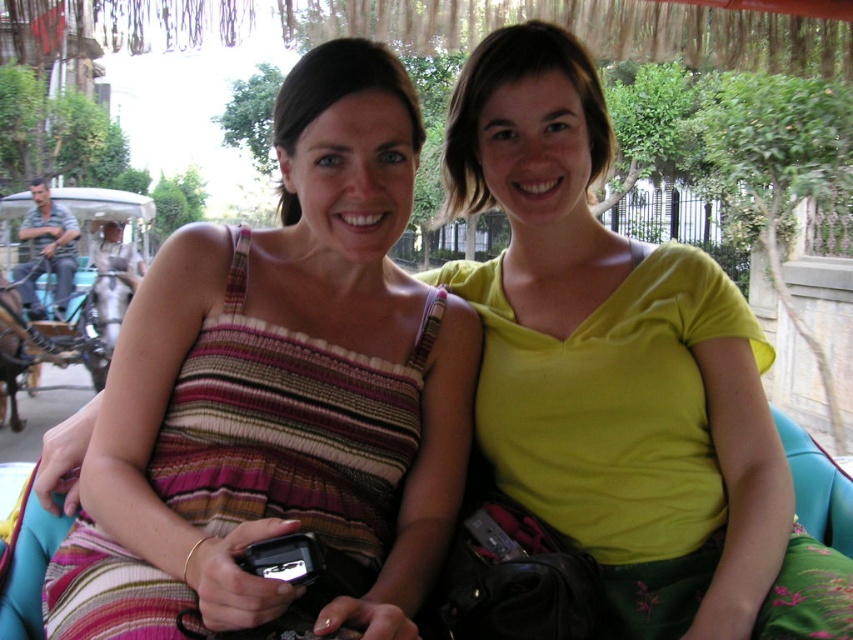
Question: Which object is farther from the camera taking this photo?

Choices:
 (A) black plastic phone at center
 (B) striped fabric dress at center
 (C) brushed metal coach at left
 (D) yellow matte shirt at center

Answer: (C)

Question: Is striped fabric dress at center thinner than yellow matte shirt at center?

Choices:
 (A) yes
 (B) no

Answer: (B)

Question: Considering the real-world distances, which object is farthest from the yellow matte shirt at center?

Choices:
 (A) black plastic phone at center
 (B) striped fabric dress at center

Answer: (A)

Question: Does striped fabric dress at center appear over brushed metal coach at left?

Choices:
 (A) yes
 (B) no

Answer: (B)

Question: Considering the real-world distances, which object is closest to the yellow matte shirt at center?

Choices:
 (A) black plastic phone at center
 (B) brushed metal coach at left
 (C) striped fabric dress at center

Answer: (C)

Question: Is yellow matte shirt at center further to the viewer compared to black plastic phone at center?

Choices:
 (A) yes
 (B) no

Answer: (A)